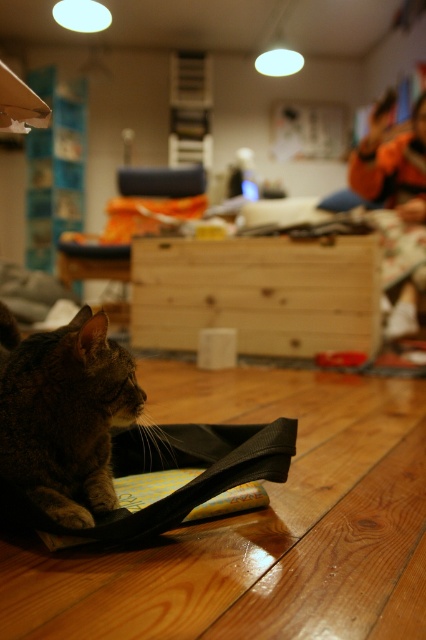
Question: Among these objects, which one is nearest to the camera?

Choices:
 (A) tabby fur cat at center
 (B) natural wood drawer at center

Answer: (A)

Question: Is natural wood drawer at center above tabby fur cat at center?

Choices:
 (A) yes
 (B) no

Answer: (A)

Question: Which object appears closest to the camera in this image?

Choices:
 (A) natural wood drawer at center
 (B) tabby fur cat at center

Answer: (B)

Question: Is natural wood drawer at center bigger than tabby fur cat at center?

Choices:
 (A) no
 (B) yes

Answer: (B)

Question: Is natural wood drawer at center positioned in front of tabby fur cat at center?

Choices:
 (A) no
 (B) yes

Answer: (A)

Question: Which object appears closest to the camera in this image?

Choices:
 (A) tabby fur cat at center
 (B) natural wood drawer at center

Answer: (A)